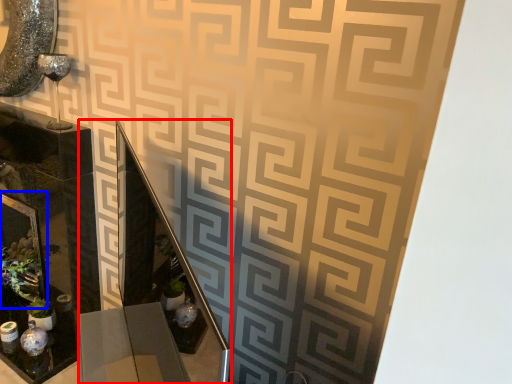
Question: Which point is further to the camera, vanity (highlighted by a red box) or picture frame (highlighted by a blue box)?

Choices:
 (A) vanity
 (B) picture frame

Answer: (B)